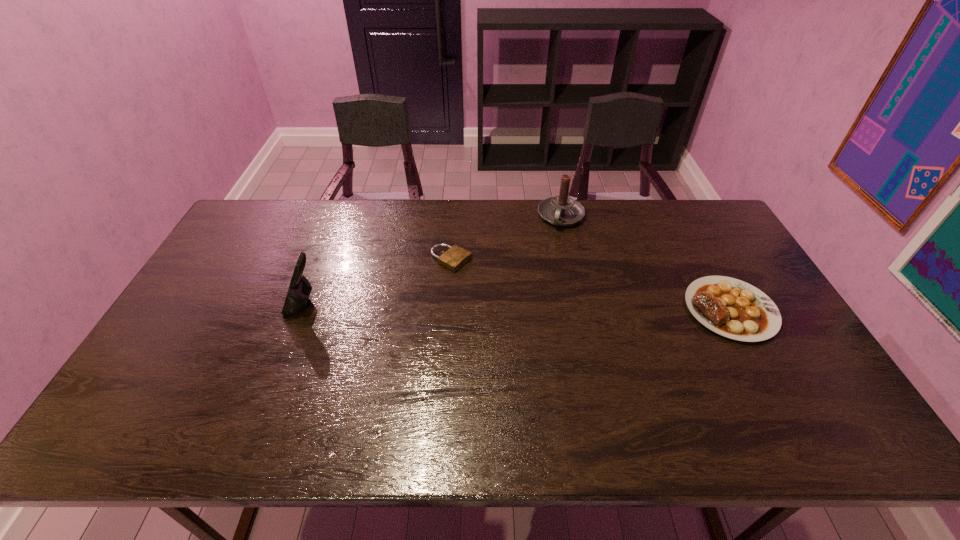
In order to click on vacant region at the near edge of the desktop in this screenshot , I will do `click(388, 377)`.

Locate an element on the screen. The width and height of the screenshot is (960, 540). vacant space at the left edge of the desktop is located at coordinates (222, 282).

In order to click on vacant space at the right edge in this screenshot , I will do `click(730, 249)`.

This screenshot has height=540, width=960. In order to click on free space at the far left corner in this screenshot , I will do `click(263, 200)`.

Locate an element on the screen. unoccupied area between the third object from right to left and the steak is located at coordinates (590, 285).

Locate an element on the screen. The width and height of the screenshot is (960, 540). unoccupied position between the cellular telephone and the steak is located at coordinates (516, 307).

Find the location of a particular element. empty location between the candle and the second object from left to right is located at coordinates (506, 238).

The width and height of the screenshot is (960, 540). Identify the location of unoccupied area between the rightmost object and the cellular telephone. coord(516,307).

Image resolution: width=960 pixels, height=540 pixels. In order to click on vacant area between the second object from right to left and the cellular telephone in this screenshot , I will do `click(432, 260)`.

Where is `vacant area between the farthest object and the third tallest object`? This screenshot has height=540, width=960. vacant area between the farthest object and the third tallest object is located at coordinates (646, 263).